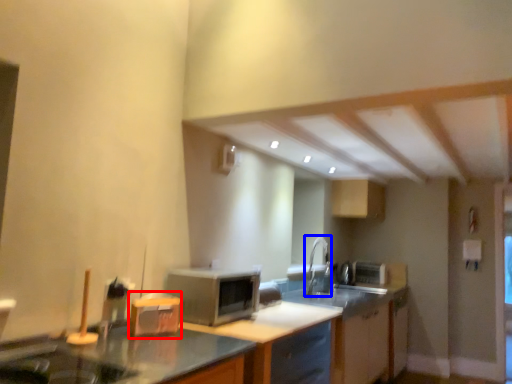
Question: Which object is closer to the camera taking this photo, appliance (highlighted by a red box) or faucet (highlighted by a blue box)?

Choices:
 (A) appliance
 (B) faucet

Answer: (A)